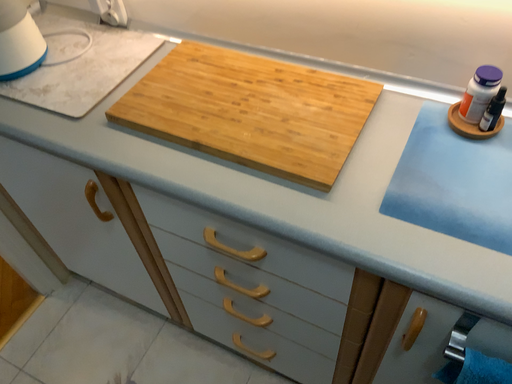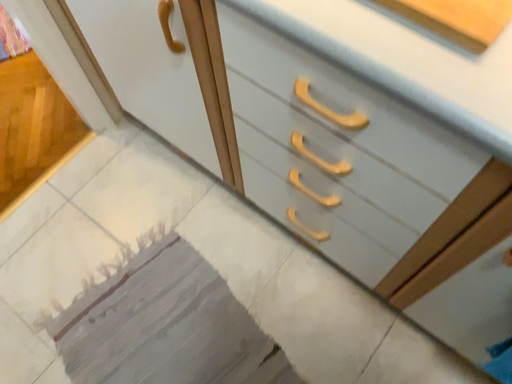
Question: Which way did the camera rotate in the video?

Choices:
 (A) rotated upward
 (B) rotated downward

Answer: (B)